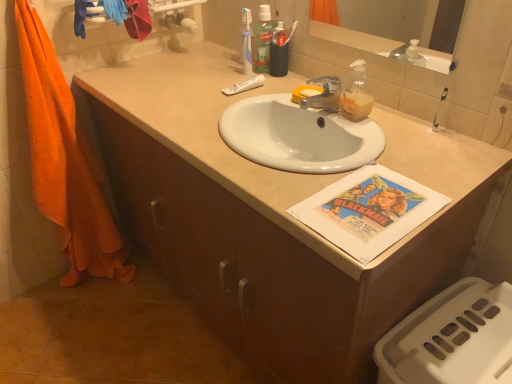
Question: From the image's perspective, is green plastic mouthwash at upper center located above or below white matte tube at center?

Choices:
 (A) below
 (B) above

Answer: (B)

Question: Is green plastic mouthwash at upper center wider or thinner than white matte tube at center?

Choices:
 (A) wide
 (B) thin

Answer: (B)

Question: Estimate the real-world distances between objects in this image. Which object is closer to the white matte tube at center?

Choices:
 (A) silver metallic faucet at center
 (B) orange cotton towel at left
 (C) green plastic mouthwash at upper center

Answer: (C)

Question: Which is farther from the orange cotton towel at left?

Choices:
 (A) silver metallic faucet at center
 (B) green plastic mouthwash at upper center
 (C) white matte tube at center

Answer: (A)